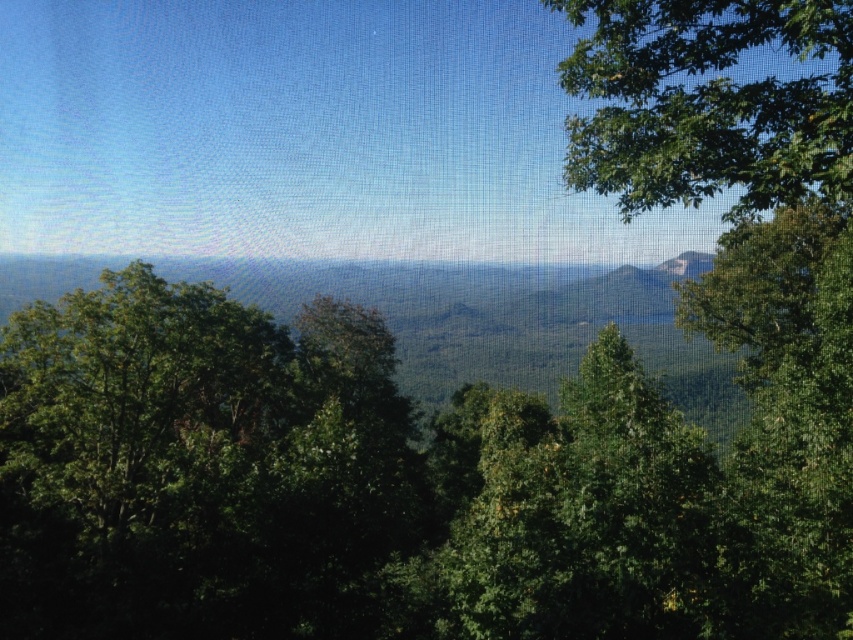
Question: Which object is positioned closest to the green leafy tree at upper right?

Choices:
 (A) green leafy tree at left
 (B) green leafy tree at right

Answer: (B)

Question: Is green leafy tree at right positioned in front of green mossy rock at upper right?

Choices:
 (A) no
 (B) yes

Answer: (B)

Question: Which of these objects is positioned farthest from the green mossy rock at upper right?

Choices:
 (A) green leafy tree at upper right
 (B) green leafy tree at right

Answer: (B)

Question: In this image, where is green leafy tree at right located relative to green leafy tree at upper right?

Choices:
 (A) below
 (B) above

Answer: (A)

Question: Which of the following is the farthest from the observer?

Choices:
 (A) (260, 438)
 (B) (786, 24)
 (C) (843, 589)

Answer: (A)

Question: Is green leafy tree at upper right to the left of green mossy rock at upper right from the viewer's perspective?

Choices:
 (A) yes
 (B) no

Answer: (A)